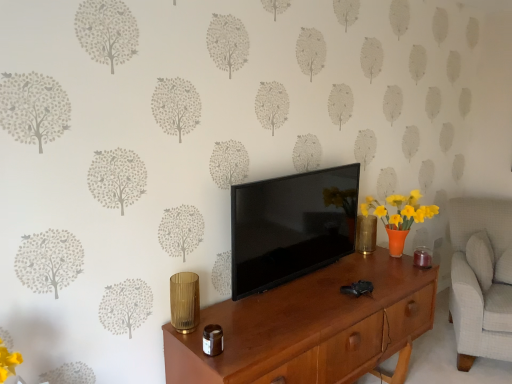
Question: Is black glossy tv at center thinner than light gray fabric swivel chair at right?

Choices:
 (A) no
 (B) yes

Answer: (B)

Question: Is black glossy tv at center aimed at light gray fabric swivel chair at right?

Choices:
 (A) no
 (B) yes

Answer: (A)

Question: From a real-world perspective, is black glossy tv at center located beneath light gray fabric swivel chair at right?

Choices:
 (A) yes
 (B) no

Answer: (B)

Question: Considering the relative sizes of black glossy tv at center and light gray fabric swivel chair at right in the image provided, is black glossy tv at center bigger than light gray fabric swivel chair at right?

Choices:
 (A) no
 (B) yes

Answer: (A)

Question: Is light gray fabric swivel chair at right surrounded by black glossy tv at center?

Choices:
 (A) no
 (B) yes

Answer: (A)

Question: From the image's perspective, does black glossy tv at center appear lower than light gray fabric swivel chair at right?

Choices:
 (A) yes
 (B) no

Answer: (B)

Question: From the image's perspective, is gold textured vase at center-right on top of wooden desk at center?

Choices:
 (A) no
 (B) yes

Answer: (B)

Question: From a real-world perspective, is gold textured vase at center-right positioned over wooden desk at center based on gravity?

Choices:
 (A) yes
 (B) no

Answer: (A)

Question: Considering the relative sizes of gold textured vase at center-right and wooden desk at center in the image provided, is gold textured vase at center-right taller than wooden desk at center?

Choices:
 (A) yes
 (B) no

Answer: (B)

Question: Is wooden desk at center located within gold textured vase at center-right?

Choices:
 (A) yes
 (B) no

Answer: (B)

Question: Is gold textured vase at center-right turned away from wooden desk at center?

Choices:
 (A) yes
 (B) no

Answer: (B)

Question: Does gold textured vase at center-right have a smaller size compared to wooden desk at center?

Choices:
 (A) no
 (B) yes

Answer: (B)

Question: From a real-world perspective, does wooden desk at center sit lower than gold textured vase at center-right?

Choices:
 (A) yes
 (B) no

Answer: (A)